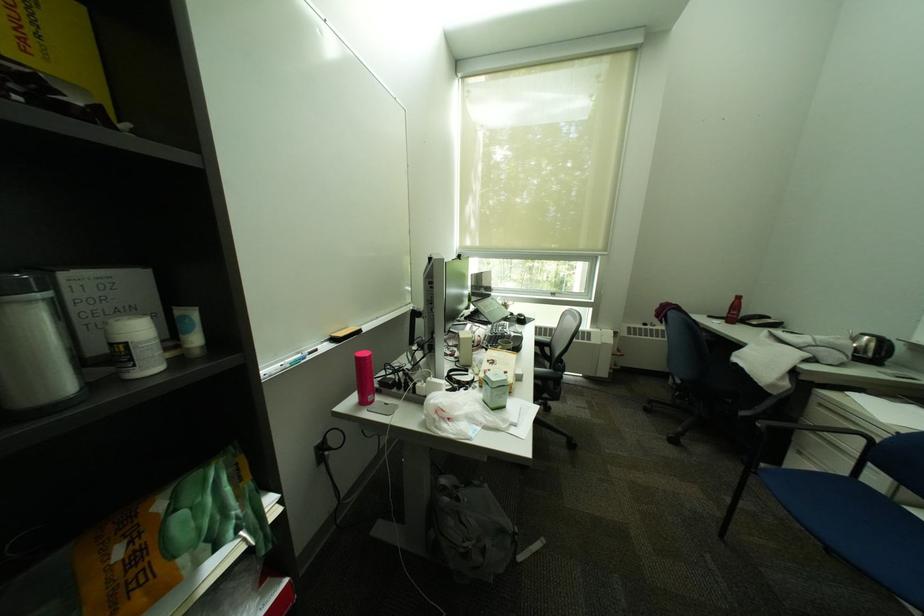
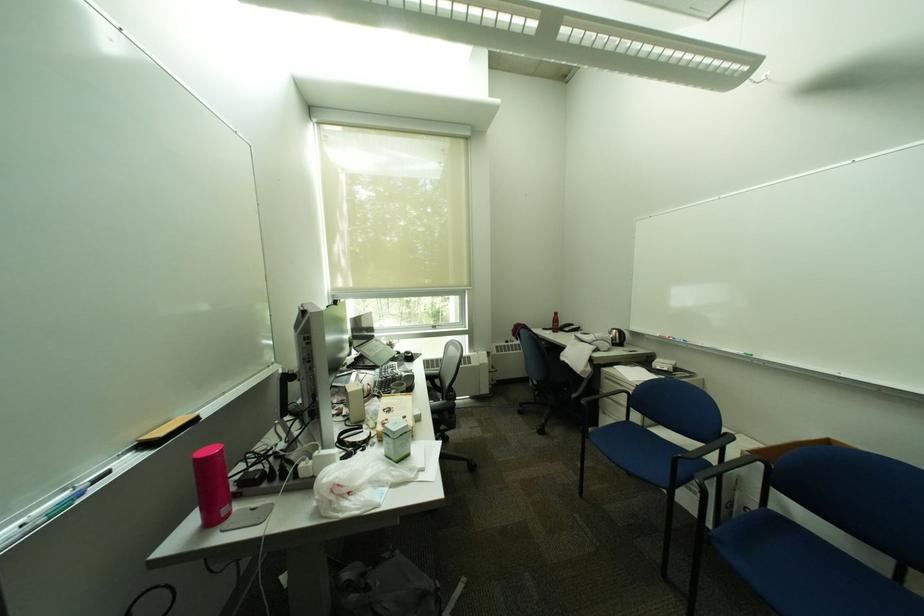
Find the pixel in the second image that matches (x=345, y=336) in the first image.

(155, 439)